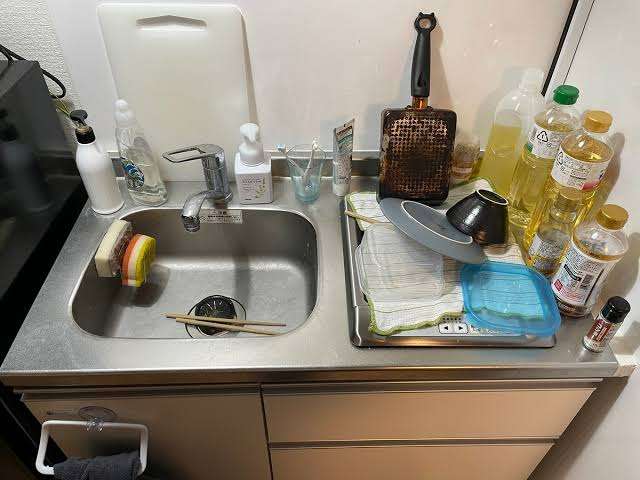
The image size is (640, 480). In order to click on drawers in this screenshot , I will do `click(317, 422)`, `click(312, 463)`.